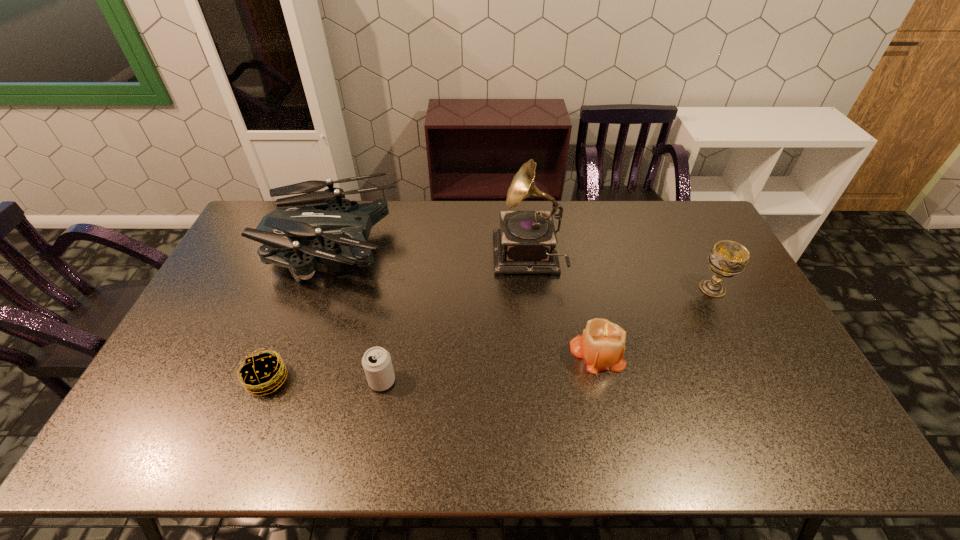
Identify the location of the tallest object. (526, 242).

Image resolution: width=960 pixels, height=540 pixels. I want to click on drone, so click(x=340, y=220).

This screenshot has width=960, height=540. In order to click on the rightmost object in this screenshot , I will do `click(727, 258)`.

Where is `candle`? This screenshot has width=960, height=540. candle is located at coordinates (602, 345).

At what (x,y) coordinates should I click in order to perform the action: click on the second shortest object. Please return your answer as a coordinate pair (x, y). The image size is (960, 540). Looking at the image, I should click on (377, 364).

You are a GUI agent. You are given a task and a screenshot of the screen. Output one action in this format:
    pyautogui.click(x=<x>, y=<y>)
    Task: Click on the patty
    The height and width of the screenshot is (540, 960).
    Given the screenshot: What is the action you would take?
    point(262,373)

The height and width of the screenshot is (540, 960). I want to click on vacant region located on the horn of the record player, so click(415, 259).

This screenshot has width=960, height=540. What are the coordinates of `vacant space positioned on the horn of the record player` in the screenshot? It's located at (450, 259).

You are a GUI agent. You are given a task and a screenshot of the screen. Output one action in this format:
    pyautogui.click(x=<x>, y=<y>)
    Task: Click on the vacant space located 0.140m on the horn of the record player
    The image size is (960, 540).
    Given the screenshot: What is the action you would take?
    pyautogui.click(x=453, y=259)

You are a GUI agent. You are given a task and a screenshot of the screen. Output one action in this format:
    pyautogui.click(x=<x>, y=<y>)
    Task: Click on the free space located on the front of the drone
    Image resolution: width=960 pixels, height=540 pixels.
    Given the screenshot: What is the action you would take?
    pyautogui.click(x=282, y=384)